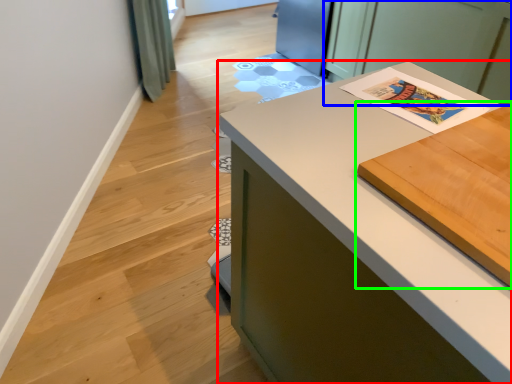
Question: Which is farther away from countertop (highlighted by a red box)? cabinetry (highlighted by a blue box) or table (highlighted by a green box)?

Choices:
 (A) cabinetry
 (B) table

Answer: (A)